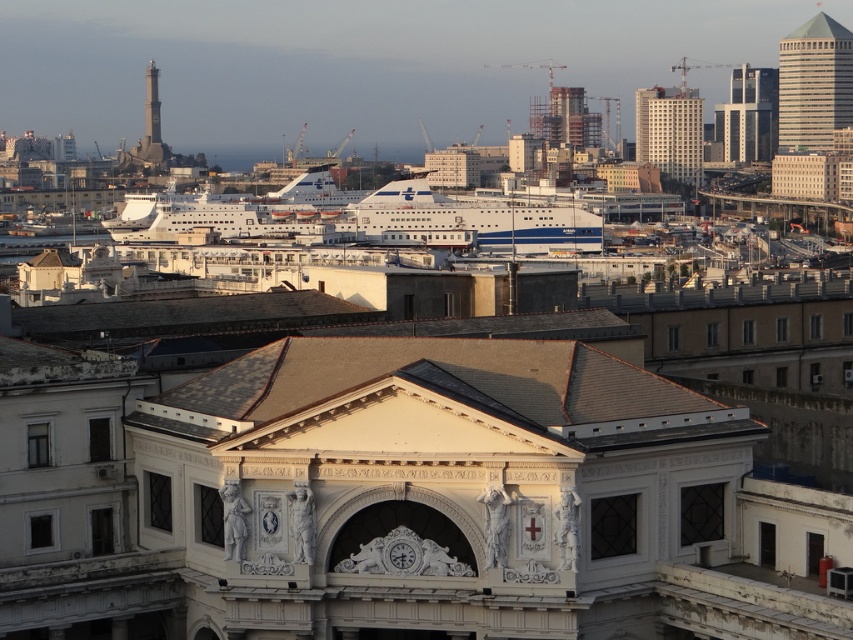
Can you confirm if white glossy cruise ship at center is positioned to the left of glassy white skyscraper at upper right?

Indeed, white glossy cruise ship at center is positioned on the left side of glassy white skyscraper at upper right.

Does point (511, 230) come in front of point (815, 124)?

Yes, it is.

Who is more forward, (373, 221) or (785, 38)?

Positioned in front is point (373, 221).

Where is `white glossy cruise ship at center`? This screenshot has height=640, width=853. white glossy cruise ship at center is located at coordinates (379, 218).

Is point (784, 42) closer to camera compared to point (155, 112)?

Yes, it is in front of point (155, 112).

Between point (834, 100) and point (157, 141), which one is positioned behind?

The point (157, 141) is behind.

From the picture: Who is more forward, (846, 67) or (141, 154)?

Positioned in front is point (846, 67).

Locate an element on the screen. This screenshot has width=853, height=640. glassy white skyscraper at upper right is located at coordinates (814, 84).

Which is more to the right, white glossy cruise ship at center or white smooth building at upper right?

white smooth building at upper right is more to the right.

Is white glossy cruise ship at center bigger than white smooth building at upper right?

Indeed, white glossy cruise ship at center has a larger size compared to white smooth building at upper right.

Is point (426, 208) positioned before point (645, 115)?

Yes.

Identify the location of white glossy cruise ship at center. (379, 218).